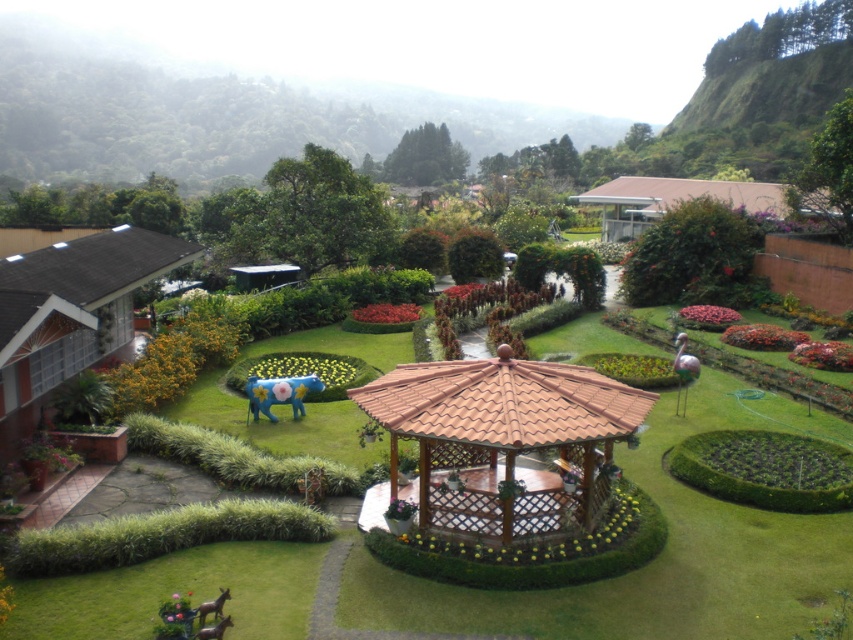
Question: Which object is closer to the camera taking this photo?

Choices:
 (A) metallic brown deer at lower left
 (B) blue painted plastic elephant at center
 (C) brown wooden gazebo at center
 (D) green grass at center

Answer: (A)

Question: Among these objects, which one is farthest from the camera?

Choices:
 (A) blue painted plastic elephant at center
 (B) green grass at center

Answer: (A)

Question: Does brown wooden horse at lower left lie in front of metallic brown deer at lower left?

Choices:
 (A) yes
 (B) no

Answer: (B)

Question: Based on their relative distances, which object is nearer to the metallic brown deer at lower left?

Choices:
 (A) green grass at center
 (B) brown wooden horse at lower left
 (C) brown wooden gazebo at center

Answer: (B)

Question: Can you confirm if brown wooden gazebo at center is bigger than brown wooden horse at lower left?

Choices:
 (A) yes
 (B) no

Answer: (B)

Question: Observing the image, what is the correct spatial positioning of brown wooden horse at lower left in reference to metallic brown deer at lower left?

Choices:
 (A) right
 (B) left

Answer: (B)